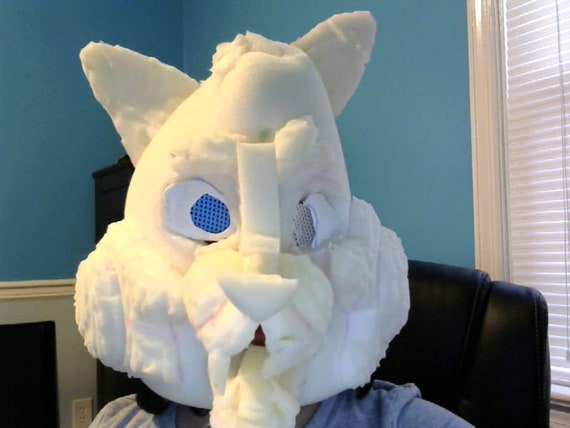
Find the location of `chair rail`. chair rail is located at coordinates (35, 284).